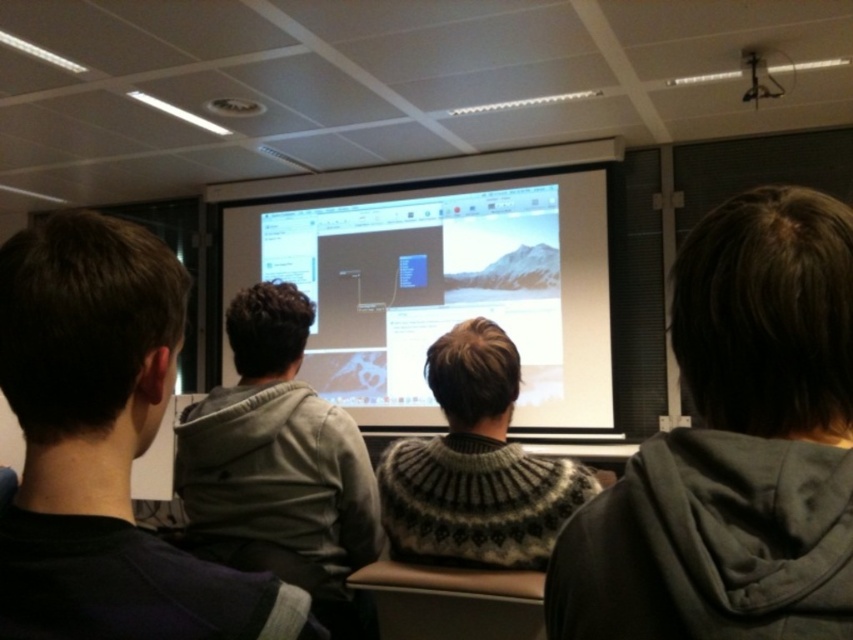
Who is shorter, gray hoodie at right or dark gray hoodie at left?

Standing shorter between the two is dark gray hoodie at left.

Who is more distant from viewer, (x=842, y=490) or (x=39, y=429)?

Point (x=39, y=429)

I want to click on gray hoodie at right, so click(734, 448).

Who is more distant from viewer, [32,387] or [546,419]?

Point [546,419]

Can you confirm if dark gray hoodie at left is thinner than white glossy projection screen at center?

Correct, dark gray hoodie at left's width is less than white glossy projection screen at center's.

This screenshot has width=853, height=640. I want to click on dark gray hoodie at left, so click(103, 448).

Can you confirm if gray fleece hoodie at center is positioned to the left of knitted sweater at center?

Indeed, gray fleece hoodie at center is positioned on the left side of knitted sweater at center.

Is gray fleece hoodie at center positioned in front of knitted sweater at center?

No, gray fleece hoodie at center is further to the viewer.

The image size is (853, 640). Describe the element at coordinates (276, 461) in the screenshot. I see `gray fleece hoodie at center` at that location.

Locate an element on the screen. gray fleece hoodie at center is located at coordinates (276, 461).